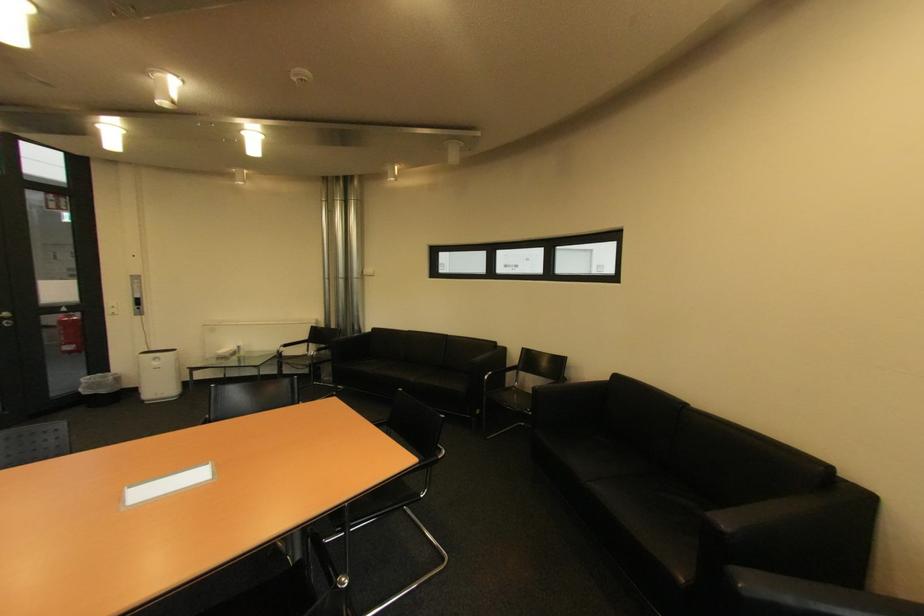
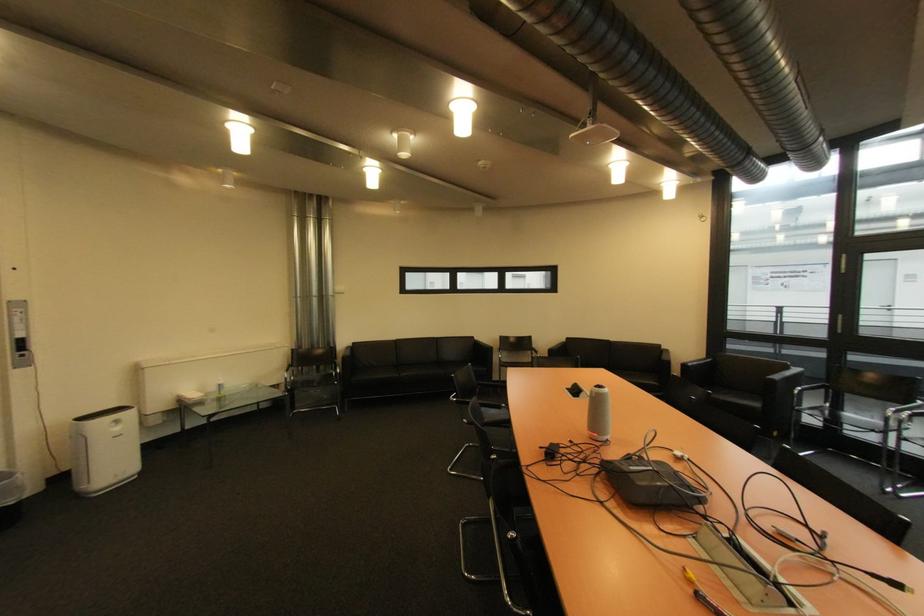
Locate, in the second image, the point that corresponds to [147,310] in the first image.

(30, 357)